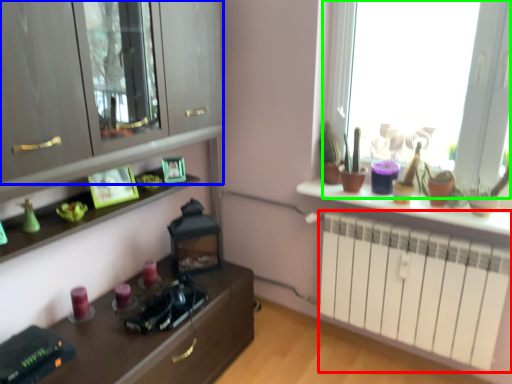
Question: Considering the real-world distances, which object is farthest from radiator (highlighted by a red box)? cabinetry (highlighted by a blue box) or window (highlighted by a green box)?

Choices:
 (A) cabinetry
 (B) window

Answer: (A)